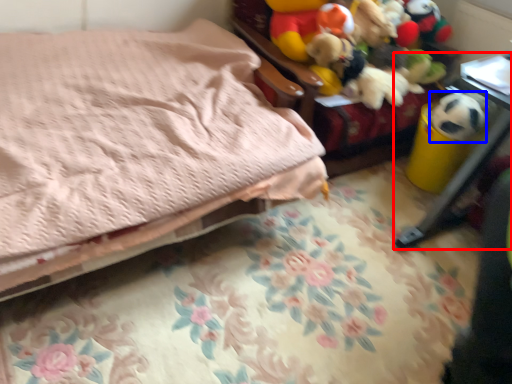
Question: Which of the following is the closest to the observer, furniture (highlighted by a red box) or animal (highlighted by a blue box)?

Choices:
 (A) furniture
 (B) animal

Answer: (A)